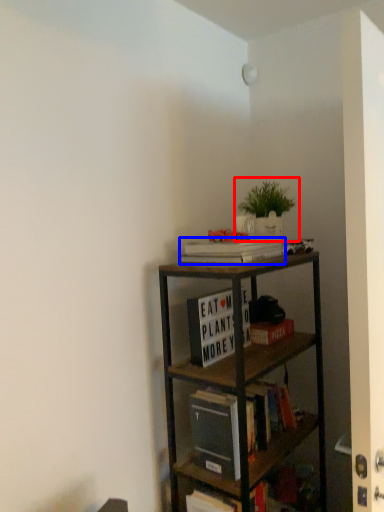
Question: Which point is closer to the camera, houseplant (highlighted by a red box) or book (highlighted by a blue box)?

Choices:
 (A) houseplant
 (B) book

Answer: (B)